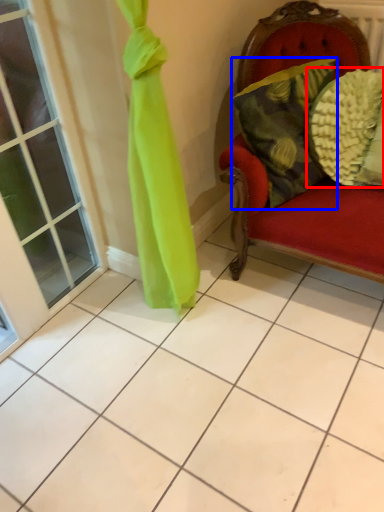
Question: Which point is further to the camera, pillow (highlighted by a red box) or pillow (highlighted by a blue box)?

Choices:
 (A) pillow
 (B) pillow

Answer: (A)